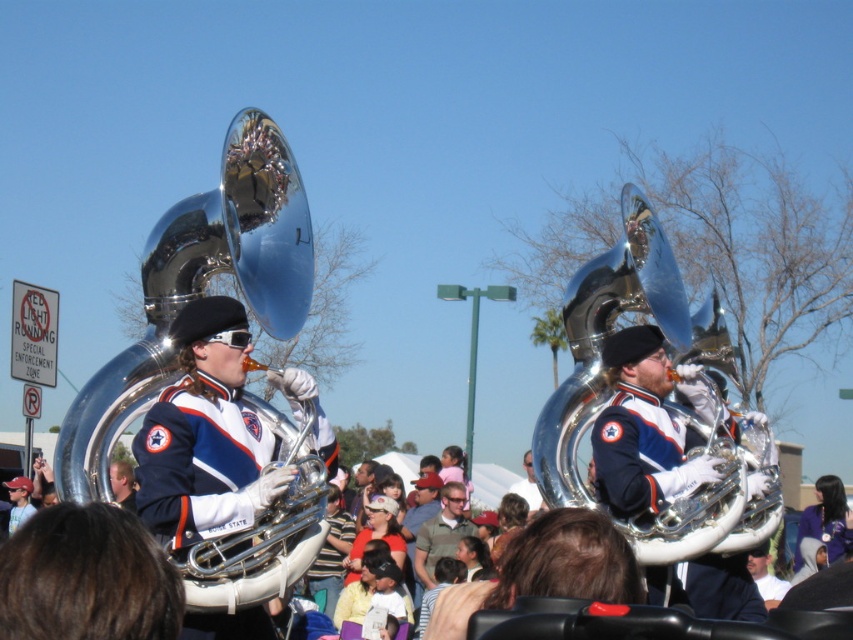
Is polished silver tuba at center in front of blue wool jacket at center?

No, it is not.

Image resolution: width=853 pixels, height=640 pixels. Describe the element at coordinates (610, 333) in the screenshot. I see `polished silver tuba at center` at that location.

Find the location of a particular element. The height and width of the screenshot is (640, 853). polished silver tuba at center is located at coordinates (610, 333).

Is the position of polished silver tuba at left less distant than that of blue wool jacket at center?

No.

Between polished silver tuba at left and blue wool jacket at center, which one is positioned lower?

blue wool jacket at center

Find the location of a particular element. The width and height of the screenshot is (853, 640). polished silver tuba at left is located at coordinates (199, 288).

Which is in front, point (601, 378) or point (534, 496)?

Point (601, 378) is more forward.

Locate an element on the screen. polished silver tuba at center is located at coordinates (610, 333).

Is point (653, 252) positioned after point (524, 456)?

That is False.

Identify the location of polished silver tuba at center. This screenshot has width=853, height=640. (610, 333).